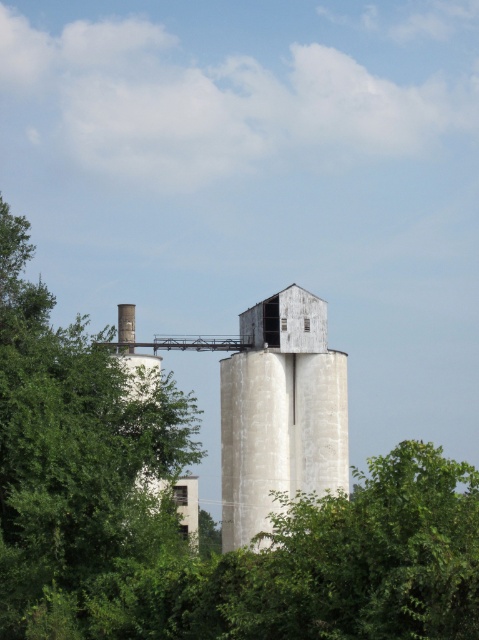
You are a drone operator trying to capture a photo of the white matte water tower at center. However, there is a green leafy tree at left in the way. Can you fly the drone around the tree to get a clear shot of the water tower?

The green leafy tree at left is in front of the white matte water tower at center, so you can fly the drone around the tree to capture the water tower behind it.

You are a drone operator trying to capture a photo of the white matte water tower at center. There is a green leafy tree at left in the way. Can you fly your drone around the tree to get a clear shot of the water tower?

The green leafy tree at left is positioned over the white matte water tower at center, so flying the drone around the tree would allow you to capture the water tower without obstruction.

You are standing at the base of the taller silo and want to walk to the green leafy tree at left. How far will you have to walk?

The distance of green leafy tree at left from viewer is 25.55 meters, so you will have to walk 25.55 meters to reach the green leafy tree at left.